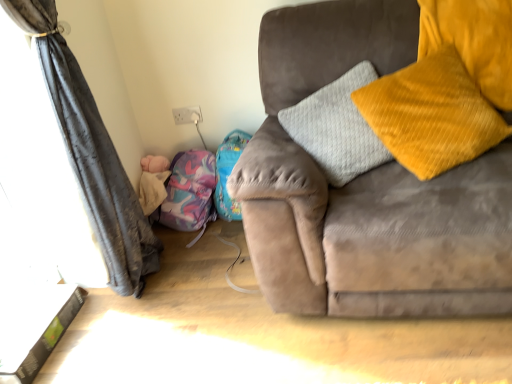
Question: Is purple fabric bean bag chair at lower left at the left side of dark grey fabric curtain at left?

Choices:
 (A) no
 (B) yes

Answer: (A)

Question: Is purple fabric bean bag chair at lower left shorter than dark grey fabric curtain at left?

Choices:
 (A) no
 (B) yes

Answer: (B)

Question: Is purple fabric bean bag chair at lower left thinner than dark grey fabric curtain at left?

Choices:
 (A) yes
 (B) no

Answer: (A)

Question: From a real-world perspective, is purple fabric bean bag chair at lower left beneath dark grey fabric curtain at left?

Choices:
 (A) yes
 (B) no

Answer: (A)

Question: Considering the relative sizes of purple fabric bean bag chair at lower left and dark grey fabric curtain at left in the image provided, is purple fabric bean bag chair at lower left wider than dark grey fabric curtain at left?

Choices:
 (A) no
 (B) yes

Answer: (A)

Question: From the image's perspective, relative to purple fabric bean bag chair at lower left, is dark grey fabric curtain at left above or below?

Choices:
 (A) below
 (B) above

Answer: (B)

Question: From a real-world perspective, is dark grey fabric curtain at left physically located above or below purple fabric bean bag chair at lower left?

Choices:
 (A) below
 (B) above

Answer: (B)

Question: Is dark grey fabric curtain at left in front of or behind purple fabric bean bag chair at lower left in the image?

Choices:
 (A) behind
 (B) front

Answer: (B)

Question: Considering the relative positions of dark grey fabric curtain at left and purple fabric bean bag chair at lower left in the image provided, is dark grey fabric curtain at left to the left or to the right of purple fabric bean bag chair at lower left?

Choices:
 (A) left
 (B) right

Answer: (A)

Question: Based on their sizes in the image, would you say purple fabric bean bag chair at lower left is bigger or smaller than soft pink plush at lower left?

Choices:
 (A) big
 (B) small

Answer: (A)

Question: Does point (180, 218) appear closer or farther from the camera than point (151, 200)?

Choices:
 (A) farther
 (B) closer

Answer: (A)

Question: In terms of width, does purple fabric bean bag chair at lower left look wider or thinner when compared to soft pink plush at lower left?

Choices:
 (A) wide
 (B) thin

Answer: (B)

Question: From a real-world perspective, is purple fabric bean bag chair at lower left above or below soft pink plush at lower left?

Choices:
 (A) above
 (B) below

Answer: (B)

Question: Considering the positions of velvet yellow pillow at right and soft pink plush at lower left in the image, is velvet yellow pillow at right wider or thinner than soft pink plush at lower left?

Choices:
 (A) wide
 (B) thin

Answer: (B)

Question: Considering the positions of velvet yellow pillow at right and soft pink plush at lower left in the image, is velvet yellow pillow at right bigger or smaller than soft pink plush at lower left?

Choices:
 (A) big
 (B) small

Answer: (A)